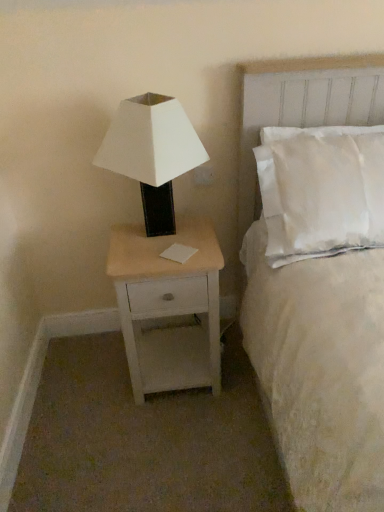
What are the coordinates of `light wood/white painted nightstand at lower left` in the screenshot? It's located at (168, 306).

Find the location of a particular element. Image resolution: width=384 pixels, height=512 pixels. white plastic electric outlet at upper right is located at coordinates (203, 175).

Image resolution: width=384 pixels, height=512 pixels. In order to click on white soft bed at upper right in this screenshot , I will do `click(307, 281)`.

How much distance is there between white soft bed at upper right and white matte/black base lamp at left?

They are 22.85 inches apart.

How many degrees apart are the facing directions of white soft bed at upper right and white matte/black base lamp at left?

white soft bed at upper right and white matte/black base lamp at left are facing 0.000483 degrees away from each other.

Is white soft bed at upper right positioned with its back to white matte/black base lamp at left?

No, white soft bed at upper right is not facing away from white matte/black base lamp at left.

Is white soft bed at upper right not near white matte/black base lamp at left?

white soft bed at upper right is actually quite close to white matte/black base lamp at left.

Is light wood/white painted nightstand at lower left located within white matte/black base lamp at left?

No, light wood/white painted nightstand at lower left is not surrounded by white matte/black base lamp at left.

Which is in front, point (133, 170) or point (125, 303)?

The point (133, 170) is closer.

Between white matte/black base lamp at left and light wood/white painted nightstand at lower left, which one has smaller width?

Thinner between the two is white matte/black base lamp at left.

Considering their positions, is white matte/black base lamp at left located in front of or behind light wood/white painted nightstand at lower left?

white matte/black base lamp at left is positioned closer to the viewer than light wood/white painted nightstand at lower left.

From the image's perspective, which object appears higher, white plastic electric outlet at upper right or white soft bed at upper right?

white plastic electric outlet at upper right is shown above in the image.

From a real-world perspective, is white plastic electric outlet at upper right physically located above or below white soft bed at upper right?

white plastic electric outlet at upper right is below white soft bed at upper right.

Considering the relative positions of white plastic electric outlet at upper right and white soft bed at upper right in the image provided, is white plastic electric outlet at upper right in front of white soft bed at upper right?

No.

Locate an element on the screen. This screenshot has width=384, height=512. electric outlet behind the white soft bed at upper right is located at coordinates (203, 175).

Which is more to the left, white matte/black base lamp at left or white plastic electric outlet at upper right?

Positioned to the left is white matte/black base lamp at left.

The image size is (384, 512). Identify the location of lamp in front of the white plastic electric outlet at upper right. (152, 153).

Can you confirm if white matte/black base lamp at left is bigger than white plastic electric outlet at upper right?

Correct, white matte/black base lamp at left is larger in size than white plastic electric outlet at upper right.

Is white matte/black base lamp at left looking in the opposite direction of white plastic electric outlet at upper right?

Absolutely, white matte/black base lamp at left is directed away from white plastic electric outlet at upper right.

Are white plastic electric outlet at upper right and white matte/black base lamp at left far apart?

white plastic electric outlet at upper right is near white matte/black base lamp at left, not far away.

This screenshot has height=512, width=384. I want to click on electric outlet that appears above the white matte/black base lamp at left (from the image's perspective), so click(x=203, y=175).

Which is closer to the camera, (x=213, y=182) or (x=104, y=153)?

Positioned in front is point (x=104, y=153).

Is white plastic electric outlet at upper right further to the viewer compared to white matte/black base lamp at left?

Yes, white plastic electric outlet at upper right is behind white matte/black base lamp at left.

From the image's perspective, is white matte/black base lamp at left positioned above or below white soft bed at upper right?

Based on their image positions, white matte/black base lamp at left is located above white soft bed at upper right.

Is white matte/black base lamp at left closer to the viewer compared to white soft bed at upper right?

No.

The height and width of the screenshot is (512, 384). I want to click on bed on the right of white matte/black base lamp at left, so click(307, 281).

Is point (176, 114) positioned after point (357, 458)?

Yes, it is.

Could you measure the distance between light wood/white painted nightstand at lower left and white plastic electric outlet at upper right?

They are 22.71 inches apart.

Is light wood/white painted nightstand at lower left thinner than white plastic electric outlet at upper right?

Incorrect, the width of light wood/white painted nightstand at lower left is not less than that of white plastic electric outlet at upper right.

How many degrees apart are the facing directions of light wood/white painted nightstand at lower left and white plastic electric outlet at upper right?

The angle between the facing direction of light wood/white painted nightstand at lower left and the facing direction of white plastic electric outlet at upper right is 0.0473 degrees.

From the image's perspective, is light wood/white painted nightstand at lower left located above or below white plastic electric outlet at upper right?

light wood/white painted nightstand at lower left is situated lower than white plastic electric outlet at upper right in the image.

This screenshot has width=384, height=512. Find the location of `bed on the right of white matte/black base lamp at left`. bed on the right of white matte/black base lamp at left is located at coordinates pyautogui.click(x=307, y=281).

Find the location of a particular element. lamp above the light wood/white painted nightstand at lower left (from a real-world perspective) is located at coordinates (152, 153).

Based on their spatial positions, is white soft bed at upper right or white matte/black base lamp at left further from white plastic electric outlet at upper right?

The object further to white plastic electric outlet at upper right is white soft bed at upper right.

Which object lies further to the anchor point white plastic electric outlet at upper right, white matte/black base lamp at left or light wood/white painted nightstand at lower left?

The object further to white plastic electric outlet at upper right is light wood/white painted nightstand at lower left.

From the image, which object appears to be nearer to white soft bed at upper right, white matte/black base lamp at left or white plastic electric outlet at upper right?

white matte/black base lamp at left is closer to white soft bed at upper right.

Considering their positions, is light wood/white painted nightstand at lower left positioned further to white soft bed at upper right than white plastic electric outlet at upper right?

white plastic electric outlet at upper right lies further to white soft bed at upper right than the other object.

Considering their positions, is white plastic electric outlet at upper right positioned closer to light wood/white painted nightstand at lower left than white matte/black base lamp at left?

white matte/black base lamp at left is closer to light wood/white painted nightstand at lower left.

Considering their positions, is light wood/white painted nightstand at lower left positioned closer to white plastic electric outlet at upper right than white soft bed at upper right?

light wood/white painted nightstand at lower left.

Considering their positions, is white soft bed at upper right positioned closer to white plastic electric outlet at upper right than light wood/white painted nightstand at lower left?

Among the two, light wood/white painted nightstand at lower left is located nearer to white plastic electric outlet at upper right.

From the picture: Estimate the real-world distances between objects in this image. Which object is further from white soft bed at upper right, light wood/white painted nightstand at lower left or white matte/black base lamp at left?

white matte/black base lamp at left is further to white soft bed at upper right.

This screenshot has height=512, width=384. In order to click on lamp between white soft bed at upper right and white plastic electric outlet at upper right from front to back in this screenshot , I will do `click(152, 153)`.

Where is `nightstand positioned between white soft bed at upper right and white plastic electric outlet at upper right from near to far`? The width and height of the screenshot is (384, 512). nightstand positioned between white soft bed at upper right and white plastic electric outlet at upper right from near to far is located at coordinates (168, 306).

Find the location of `lamp between white plastic electric outlet at upper right and light wood/white painted nightstand at lower left in the up-down direction`. lamp between white plastic electric outlet at upper right and light wood/white painted nightstand at lower left in the up-down direction is located at coordinates (152, 153).

The image size is (384, 512). I want to click on nightstand between white matte/black base lamp at left and white soft bed at upper right in the horizontal direction, so click(168, 306).